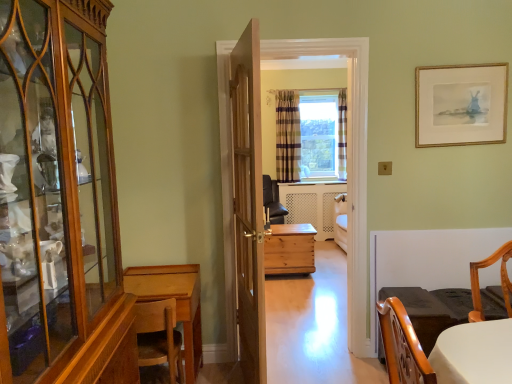
At what (x,y) coordinates should I click in order to perform the action: click on blank space situated above white glossy table at lower right (from a real-world perspective). Please return your answer as a coordinate pair (x, y). The height and width of the screenshot is (384, 512). Looking at the image, I should click on (450, 301).